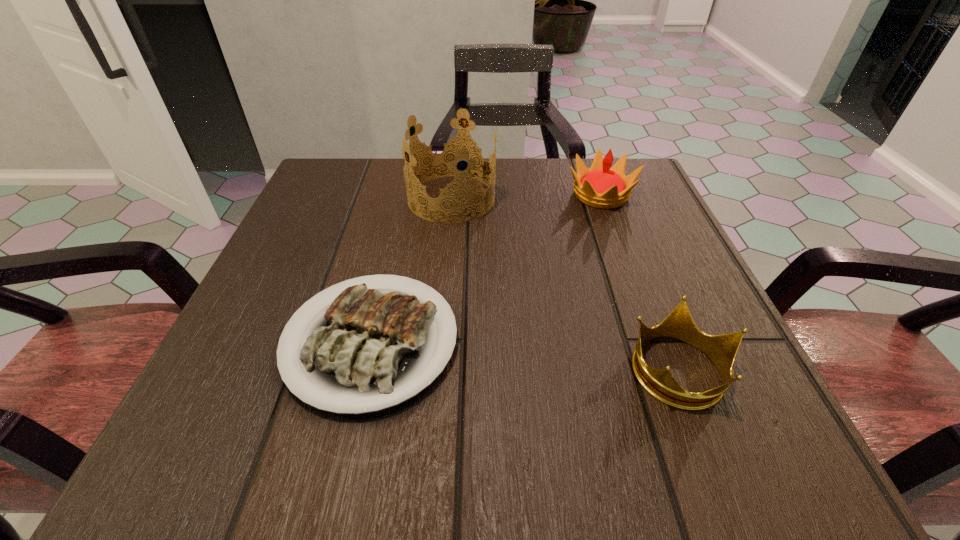
You are a GUI agent. You are given a task and a screenshot of the screen. Output one action in this format:
    pyautogui.click(x=<x>, y=<y>)
    Task: Click on the crown at the near edge
    The width and height of the screenshot is (960, 540).
    Given the screenshot: What is the action you would take?
    pyautogui.click(x=679, y=325)

What are the coordinates of `plate that is at the near edge` in the screenshot? It's located at (364, 354).

Locate an element on the screen. This screenshot has height=540, width=960. object that is at the left edge is located at coordinates (364, 354).

This screenshot has width=960, height=540. What are the coordinates of `object positioned at the near left corner` in the screenshot? It's located at (364, 354).

Locate an element on the screen. The height and width of the screenshot is (540, 960). object located at the far right corner is located at coordinates (601, 186).

Locate an element on the screen. object at the near right corner is located at coordinates (679, 325).

In the image, there is a desktop. At what (x,y) coordinates should I click in order to perform the action: click on free space at the far edge. Please return your answer as a coordinate pair (x, y). Image resolution: width=960 pixels, height=540 pixels. Looking at the image, I should click on pyautogui.click(x=570, y=198).

In the image, there is a desktop. Where is `blank space at the near edge`? blank space at the near edge is located at coordinates (517, 411).

Locate an element on the screen. The image size is (960, 540). vacant space at the left edge of the desktop is located at coordinates (301, 235).

This screenshot has height=540, width=960. What are the coordinates of `vacant space at the right edge of the desktop` in the screenshot? It's located at (628, 240).